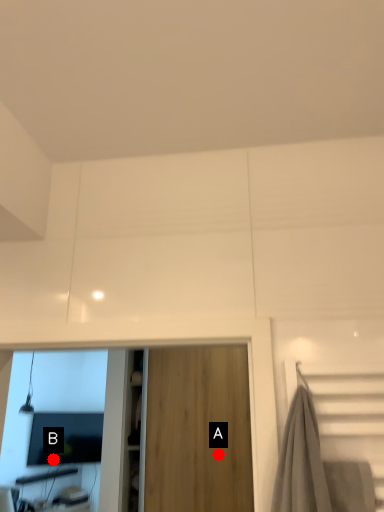
Question: Two points are circled on the image, labeled by A and B beside each circle. Among these points, which one is farthest from the camera?

Choices:
 (A) A is further
 (B) B is further

Answer: (B)